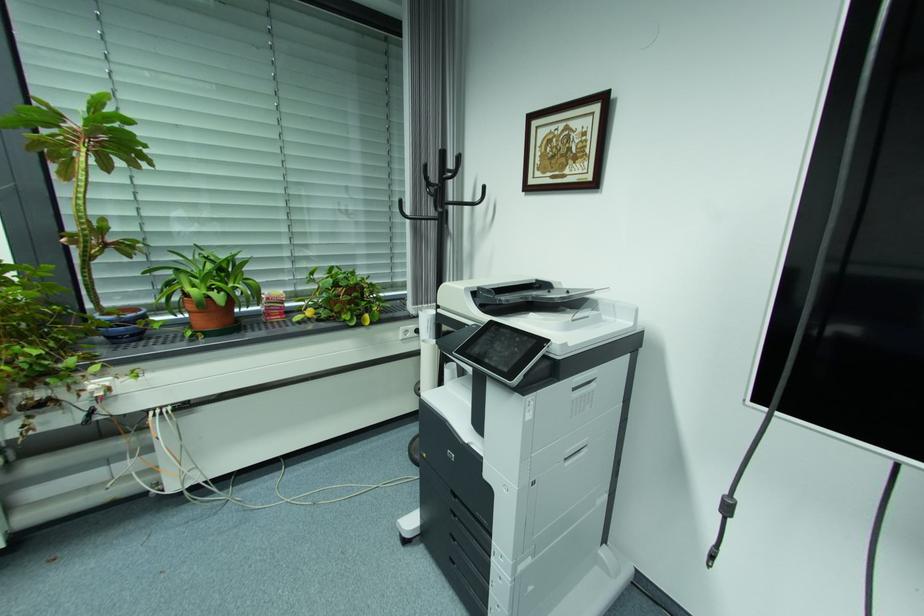
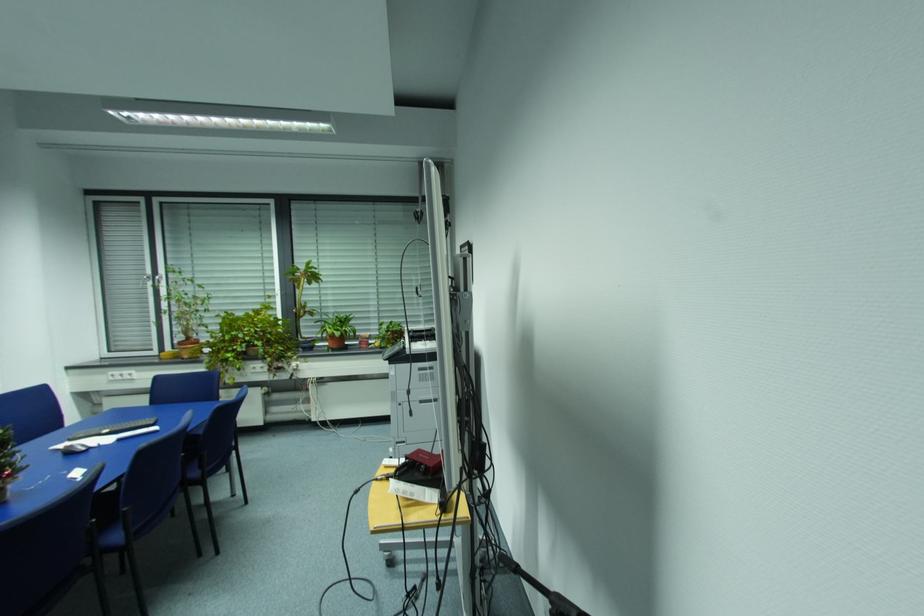
The images are taken continuously from a first-person perspective. In which direction are you moving?

The cameraman moved toward right, backward.